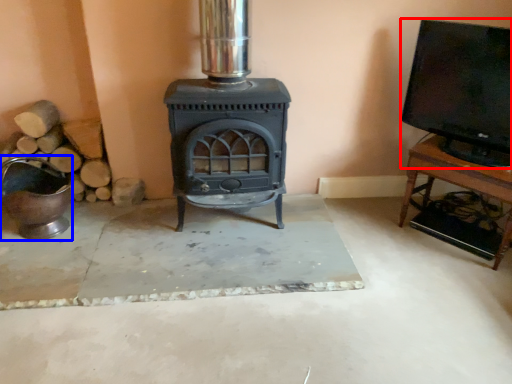
Question: Which object appears closest to the camera in this image, wide (highlighted by a red box) or appliance (highlighted by a blue box)?

Choices:
 (A) wide
 (B) appliance

Answer: (A)